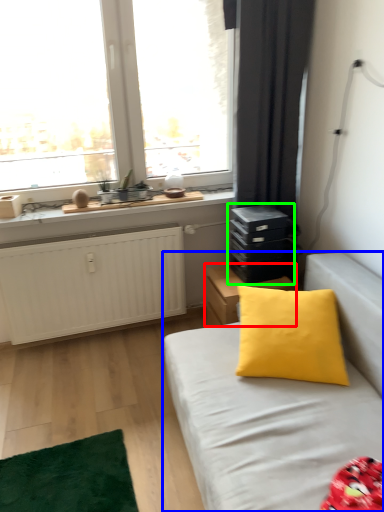
Question: Considering the real-world distances, which object is closest to nightstand (highlighted by a red box)? studio couch (highlighted by a blue box) or dresser (highlighted by a green box).

Choices:
 (A) studio couch
 (B) dresser

Answer: (B)